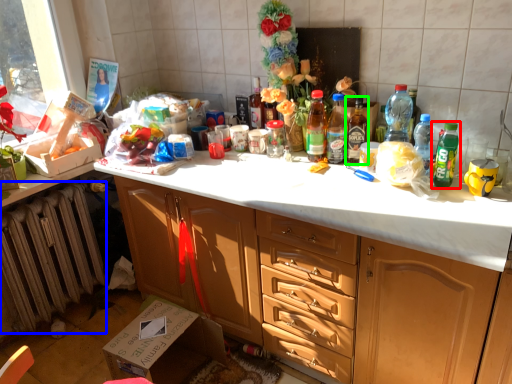
Question: Estimate the real-world distances between objects in this image. Which object is farther from bottle (highlighted by a red box), radiator (highlighted by a blue box) or bottle (highlighted by a green box)?

Choices:
 (A) radiator
 (B) bottle

Answer: (A)